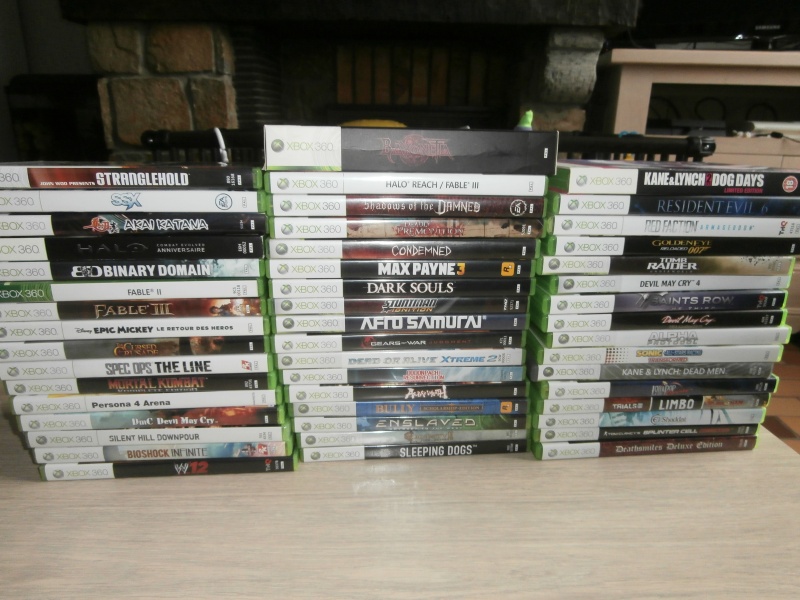
Find the location of a particular element. The image size is (800, 600). wood slates back wall is located at coordinates pos(494,72), pos(480,76), pos(462,81), pos(432,79), pos(418,79), pos(400,79), pos(380,79), pos(362,78), pos(340,76).